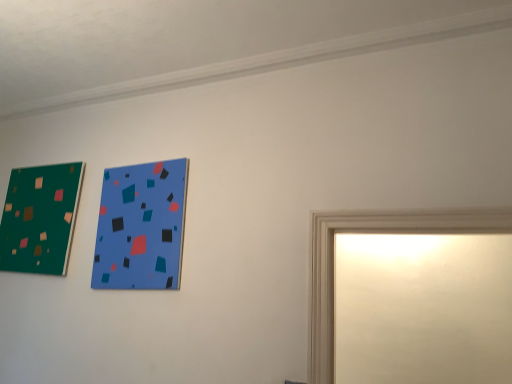
What do you see at coordinates (40, 218) in the screenshot?
I see `matte green picture frame at upper left, the 1th picture frame viewed from the back` at bounding box center [40, 218].

Locate an element on the screen. matte green picture frame at upper left, the 1th picture frame viewed from the back is located at coordinates (40, 218).

You are a GUI agent. You are given a task and a screenshot of the screen. Output one action in this format:
    pyautogui.click(x=<x>, y=<y>)
    Task: Click on the blue matte picture frame at upper center, marked as the 1th picture frame in a front-to-back arrangement
    
    Given the screenshot: What is the action you would take?
    pyautogui.click(x=141, y=226)

Describe the element at coordinates (141, 226) in the screenshot. This screenshot has width=512, height=384. I see `blue matte picture frame at upper center, the 1th picture frame positioned from the right` at that location.

In order to click on matte green picture frame at upper left, the second picture frame positioned from the front in this screenshot , I will do `click(40, 218)`.

Would you say matte green picture frame at upper left, placed as the 1th picture frame when sorted from left to right, is to the left or to the right of blue matte picture frame at upper center, the 1th picture frame positioned from the right, in the picture?

Based on their positions, matte green picture frame at upper left, placed as the 1th picture frame when sorted from left to right, is located to the left of blue matte picture frame at upper center, the 1th picture frame positioned from the right.

Does matte green picture frame at upper left, the 1th picture frame viewed from the back, lie behind blue matte picture frame at upper center, the 2th picture frame viewed from the back?

Yes, it is.

Considering the positions of points (16, 246) and (162, 262), is point (16, 246) farther from camera compared to point (162, 262)?

Yes, point (16, 246) is behind point (162, 262).

From the image's perspective, which is above, matte green picture frame at upper left, the second picture frame positioned from the front, or blue matte picture frame at upper center, the second picture frame positioned from the left?

matte green picture frame at upper left, the second picture frame positioned from the front, appears higher in the image.

From a real-world perspective, relative to blue matte picture frame at upper center, marked as the 1th picture frame in a front-to-back arrangement, is matte green picture frame at upper left, the second picture frame positioned from the front, vertically above or below?

Clearly, from a real-world perspective, matte green picture frame at upper left, the second picture frame positioned from the front, is above blue matte picture frame at upper center, marked as the 1th picture frame in a front-to-back arrangement.

Looking at their sizes, would you say matte green picture frame at upper left, placed as the 1th picture frame when sorted from left to right, is wider or thinner than blue matte picture frame at upper center, the second picture frame positioned from the left?

In the image, matte green picture frame at upper left, placed as the 1th picture frame when sorted from left to right, appears to be wider than blue matte picture frame at upper center, the second picture frame positioned from the left.

Considering the sizes of objects matte green picture frame at upper left, the 1th picture frame viewed from the back, and blue matte picture frame at upper center, the 2th picture frame viewed from the back, in the image provided, who is taller, matte green picture frame at upper left, the 1th picture frame viewed from the back, or blue matte picture frame at upper center, the 2th picture frame viewed from the back,?

blue matte picture frame at upper center, the 2th picture frame viewed from the back.

Is matte green picture frame at upper left, placed as the 1th picture frame when sorted from left to right, bigger than blue matte picture frame at upper center, the second picture frame positioned from the left?

Correct, matte green picture frame at upper left, placed as the 1th picture frame when sorted from left to right, is larger in size than blue matte picture frame at upper center, the second picture frame positioned from the left.

Can we say matte green picture frame at upper left, the second picture frame positioned from the front, lies outside blue matte picture frame at upper center, the 2th picture frame viewed from the back?

Yes, matte green picture frame at upper left, the second picture frame positioned from the front, is located beyond the bounds of blue matte picture frame at upper center, the 2th picture frame viewed from the back.

Does matte green picture frame at upper left, the 1th picture frame viewed from the back, touch blue matte picture frame at upper center, the second picture frame positioned from the left?

There is a gap between matte green picture frame at upper left, the 1th picture frame viewed from the back, and blue matte picture frame at upper center, the second picture frame positioned from the left.

Is matte green picture frame at upper left, placed as the 1th picture frame when sorted from left to right, facing towards blue matte picture frame at upper center, the 1th picture frame positioned from the right?

No.

In the scene shown: How different are the orientations of matte green picture frame at upper left, the 1th picture frame viewed from the back, and blue matte picture frame at upper center, the 2th picture frame viewed from the back, in degrees?

0.728 degrees separate the facing orientations of matte green picture frame at upper left, the 1th picture frame viewed from the back, and blue matte picture frame at upper center, the 2th picture frame viewed from the back.

Find the location of a particular element. picture frame above the blue matte picture frame at upper center, the second picture frame positioned from the left (from the image's perspective) is located at coordinates (40, 218).

Is blue matte picture frame at upper center, the 2th picture frame viewed from the back, to the left or to the right of matte green picture frame at upper left, the second picture frame positioned from the front, in the image?

blue matte picture frame at upper center, the 2th picture frame viewed from the back, is positioned on matte green picture frame at upper left, the second picture frame positioned from the front,'s right side.

Between blue matte picture frame at upper center, the 1th picture frame positioned from the right, and matte green picture frame at upper left, the 1th picture frame viewed from the back, which one is positioned in front?

blue matte picture frame at upper center, the 1th picture frame positioned from the right, is more forward.

Which point is more forward, [106,248] or [36,167]?

The point [106,248] is in front.

From the image's perspective, which one is positioned lower, blue matte picture frame at upper center, the 2th picture frame viewed from the back, or matte green picture frame at upper left, the 1th picture frame viewed from the back?

blue matte picture frame at upper center, the 2th picture frame viewed from the back, is shown below in the image.

Consider the image. From a real-world perspective, who is located higher, blue matte picture frame at upper center, the second picture frame positioned from the left, or matte green picture frame at upper left, the 1th picture frame viewed from the back?

matte green picture frame at upper left, the 1th picture frame viewed from the back.

Considering the relative sizes of blue matte picture frame at upper center, marked as the 1th picture frame in a front-to-back arrangement, and matte green picture frame at upper left, the second picture frame positioned from the front, in the image provided, is blue matte picture frame at upper center, marked as the 1th picture frame in a front-to-back arrangement, thinner than matte green picture frame at upper left, the second picture frame positioned from the front,?

Yes.

Can you confirm if blue matte picture frame at upper center, the 2th picture frame viewed from the back, is taller than matte green picture frame at upper left, the 1th picture frame viewed from the back?

Indeed, blue matte picture frame at upper center, the 2th picture frame viewed from the back, has a greater height compared to matte green picture frame at upper left, the 1th picture frame viewed from the back.

Based on their sizes in the image, would you say blue matte picture frame at upper center, the 1th picture frame positioned from the right, is bigger or smaller than matte green picture frame at upper left, the second picture frame positioned from the front?

Clearly, blue matte picture frame at upper center, the 1th picture frame positioned from the right, is smaller in size than matte green picture frame at upper left, the second picture frame positioned from the front.

Would you say blue matte picture frame at upper center, marked as the 1th picture frame in a front-to-back arrangement, contains matte green picture frame at upper left, the second picture frame positioned from the front?

That's incorrect, matte green picture frame at upper left, the second picture frame positioned from the front, is not inside blue matte picture frame at upper center, marked as the 1th picture frame in a front-to-back arrangement.

Are blue matte picture frame at upper center, the second picture frame positioned from the left, and matte green picture frame at upper left, the second picture frame positioned from the front, located far from each other?

No, blue matte picture frame at upper center, the second picture frame positioned from the left, is not far away from matte green picture frame at upper left, the second picture frame positioned from the front.

Is blue matte picture frame at upper center, the 2th picture frame viewed from the back, facing towards matte green picture frame at upper left, the second picture frame positioned from the front?

No, blue matte picture frame at upper center, the 2th picture frame viewed from the back, is not aimed at matte green picture frame at upper left, the second picture frame positioned from the front.

Consider the image. How different are the orientations of blue matte picture frame at upper center, the 1th picture frame positioned from the right, and matte green picture frame at upper left, the 1th picture frame viewed from the back, in degrees?

The angle between the facing direction of blue matte picture frame at upper center, the 1th picture frame positioned from the right, and the facing direction of matte green picture frame at upper left, the 1th picture frame viewed from the back, is 0.728 degrees.

Could you measure the distance between blue matte picture frame at upper center, the 1th picture frame positioned from the right, and matte green picture frame at upper left, the second picture frame in the right-to-left sequence?

blue matte picture frame at upper center, the 1th picture frame positioned from the right, and matte green picture frame at upper left, the second picture frame in the right-to-left sequence, are 46.27 centimeters apart.

At what (x,y) coordinates should I click in order to perform the action: click on picture frame that is on the left side of blue matte picture frame at upper center, the 2th picture frame viewed from the back. Please return your answer as a coordinate pair (x, y). The width and height of the screenshot is (512, 384). Looking at the image, I should click on (40, 218).

Image resolution: width=512 pixels, height=384 pixels. I want to click on picture frame on the right of matte green picture frame at upper left, the second picture frame positioned from the front, so click(141, 226).

I want to click on picture frame lying behind the blue matte picture frame at upper center, the second picture frame positioned from the left, so click(40, 218).